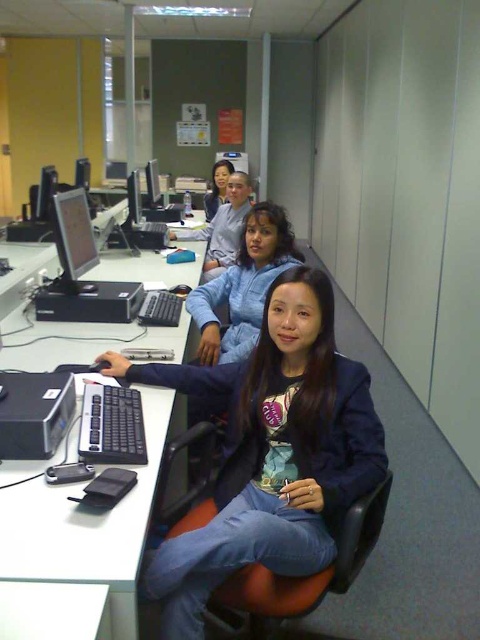
Question: Is blue denim jeans at lower center smaller than white plastic computer desk at center?

Choices:
 (A) yes
 (B) no

Answer: (A)

Question: Which object is positioned farthest from the matte black monitor at upper center?

Choices:
 (A) orange leather swivel chair at lower center
 (B) blue fleece jacket at center
 (C) blue denim jeans at lower center
 (D) matte blue hoodie at center

Answer: (A)

Question: Considering the real-world distances, which object is farthest from the satin black monitor at left?

Choices:
 (A) matte black monitor at left
 (B) matte blue hoodie at center
 (C) blue fleece jacket at center

Answer: (B)

Question: Considering the real-world distances, which object is farthest from the satin black monitor at left?

Choices:
 (A) blue fleece jacket at center
 (B) white plastic computer desk at center
 (C) matte blue hoodie at center

Answer: (C)

Question: Does satin black monitor at left have a greater width compared to matte blue hoodie at center?

Choices:
 (A) no
 (B) yes

Answer: (B)

Question: Is orange leather swivel chair at lower center below matte black monitor at upper center?

Choices:
 (A) no
 (B) yes

Answer: (B)